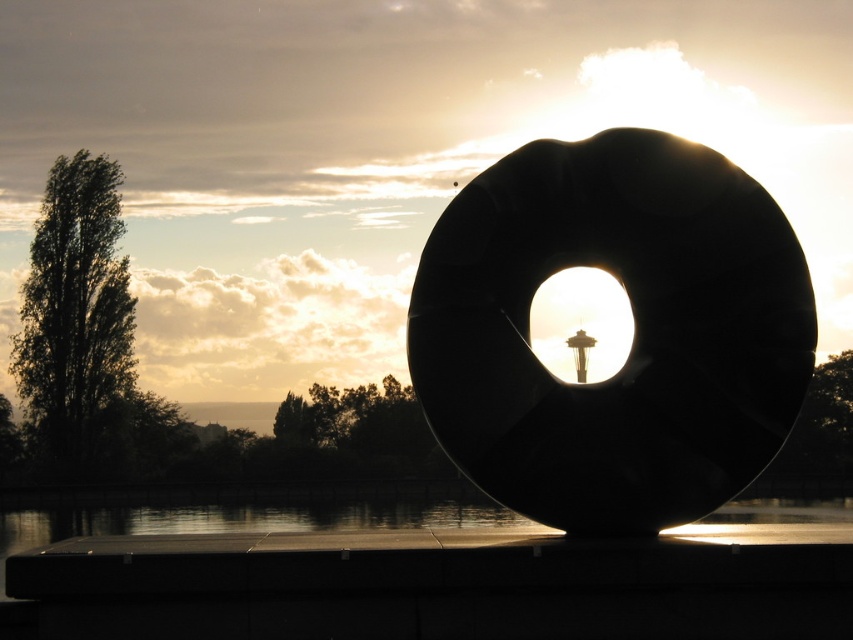
You are a photographer trying to capture the sunset through the black matte ring at center and the transparent glass water at bottom. Which object is positioned to the right side when you look at them from your camera viewfinder?

The black matte ring at center is positioned to the right of the transparent glass water at bottom.

You are standing in the outdoor scene and want to take a photo of the transparent glass water at bottom without the black matte ring at center blocking the view. Is there a way to do this?

The black matte ring at center is positioned over the transparent glass water at bottom, so you can move to a position where the black matte ring at center is out of the frame or angle your camera to avoid it to capture the transparent glass water at bottom without obstruction.